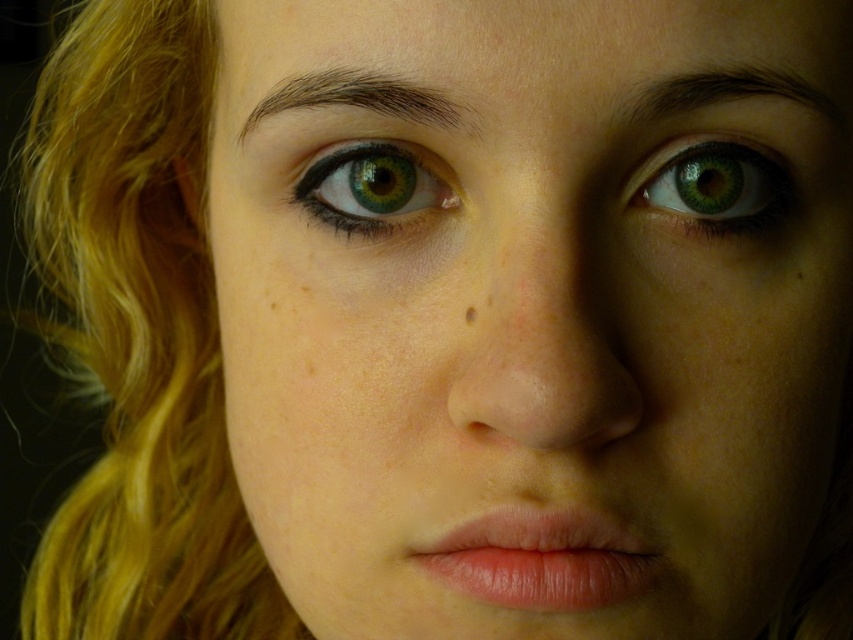
Looking at the closeup portrait, which object takes up more space in the image between the natural skin tone at center and the green matte eye at upper right?

The natural skin tone at center is larger in size than the green matte eye at upper right, so it takes up more space in the image.

You are a photographer adjusting the lighting for a portrait. You notice the natural skin tone at center and the green matte eye at upper right. Which object is located lower in the image?

The natural skin tone at center is positioned under the green matte eye at upper right, so the natural skin tone at center is lower in the image.

You are a makeup artist preparing to apply lipstick to the pink glossy lips at center. You are currently holding the lipstick tube 30 centimeters away from the lips. Based on the distance provided, will you need to move the lipstick closer or farther away to ensure precise application?

The pink glossy lips at center is 27.50 centimeters away from the viewer. Since the lipstick tube is currently held 30 centimeters away, you need to move it closer by approximately 2.5 centimeters to reach the correct distance for precise application.